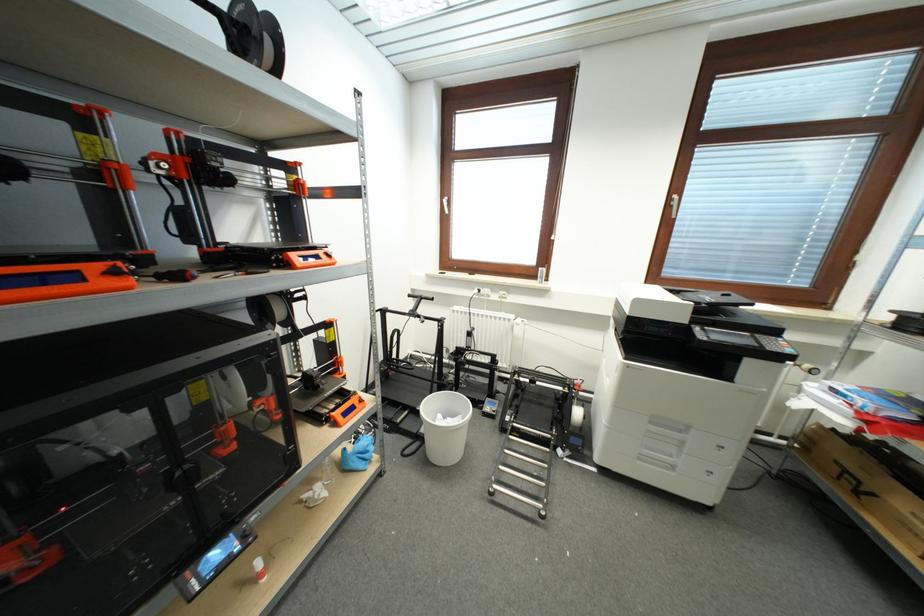
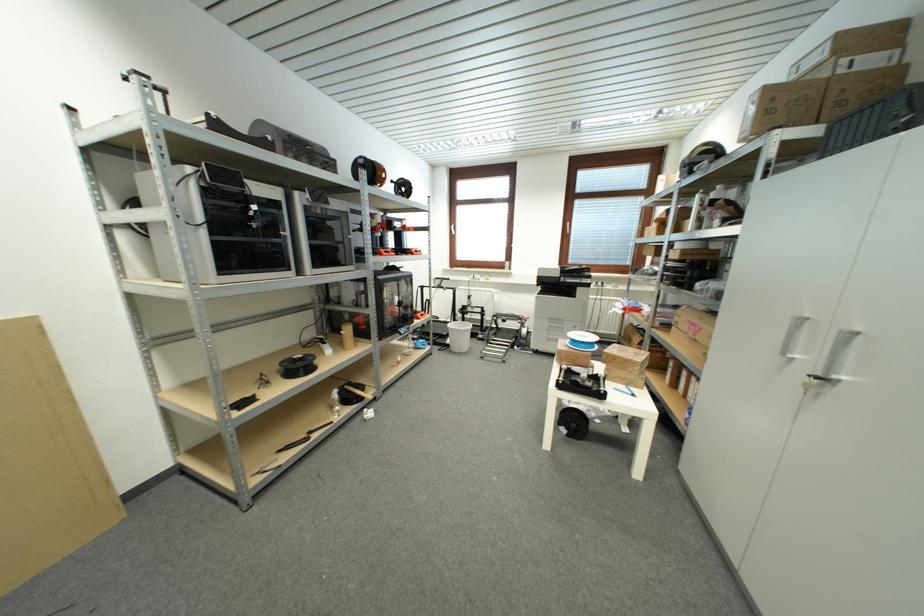
Find the pixel in the second image that matches (x=427, y=434) in the first image.

(453, 344)